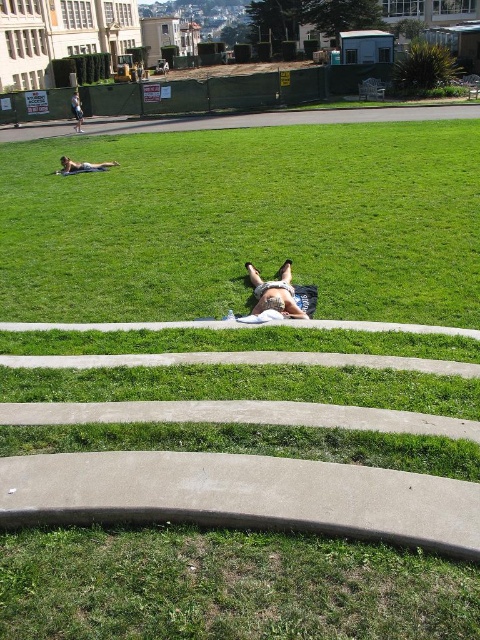
Based on the photo, you are standing at the point with coordinates (x=245, y=221) in the park scene. What is the immediate surface you would be touching if you were to kneel down?

The immediate surface you would be touching at point (x=245, y=221) is green grass at center.

You are planning to place a picnic basket between the green grass at center and the white cotton towel at center. The basket requires a minimum of 5 meters of space between them to be placed safely. Can you place it there?

The distance between the green grass at center and the white cotton towel at center is 4.64 meters, which is less than the required 5 meters. Therefore, you cannot safely place the picnic basket there.

You are a person standing at the base of the concrete steps in the image. You want to walk to the light brown skin at upper left without stepping on the green grass at center. Is this possible? Please explain.

The green grass at center and light brown skin at upper left are 6.39 meters apart. Since the grass is only at the center, you can walk around the green grass at center and reach the light brown skin at upper left without stepping on it.